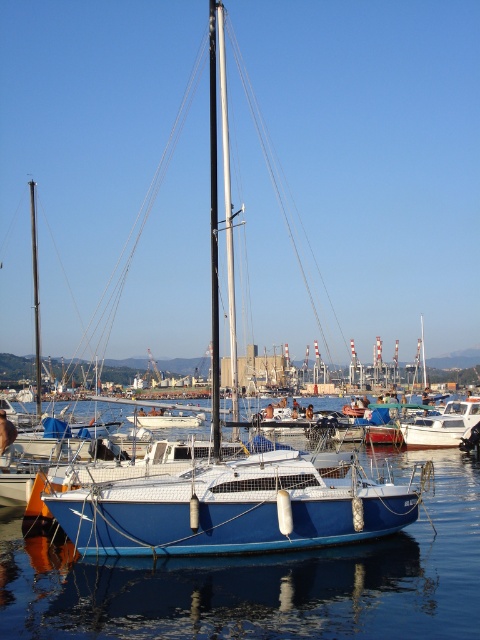
Can you confirm if blue matte sailboat at center is thinner than shiny silver mast at center?

Indeed, blue matte sailboat at center has a lesser width compared to shiny silver mast at center.

Does blue matte sailboat at center lie behind shiny silver mast at center?

That is False.

Between point (240, 538) and point (34, 204), which one is positioned behind?

The point (34, 204) is behind.

Where is `blue matte sailboat at center`? The image size is (480, 640). blue matte sailboat at center is located at coordinates (233, 509).

Between point (51, 502) and point (434, 436), which one is positioned in front?

Point (51, 502)

Consider the image. Between blue matte sailboat at center and white matte boat at center, which one is positioned lower?

white matte boat at center is lower down.

You are a GUI agent. You are given a task and a screenshot of the screen. Output one action in this format:
    pyautogui.click(x=<x>, y=<y>)
    Task: Click on the blue matte sailboat at center
    Image resolution: width=480 pixels, height=640 pixels.
    Given the screenshot: What is the action you would take?
    pyautogui.click(x=233, y=509)

Does blue glossy water at center have a greater height compared to white glossy sailboat at center?

Yes.

Can you confirm if blue glossy water at center is positioned above white glossy sailboat at center?

Correct, blue glossy water at center is located above white glossy sailboat at center.

Between point (309, 598) and point (147, 426), which one is positioned in front?

Positioned in front is point (309, 598).

What are the coordinates of `blue glossy water at center` in the screenshot? It's located at (264, 579).